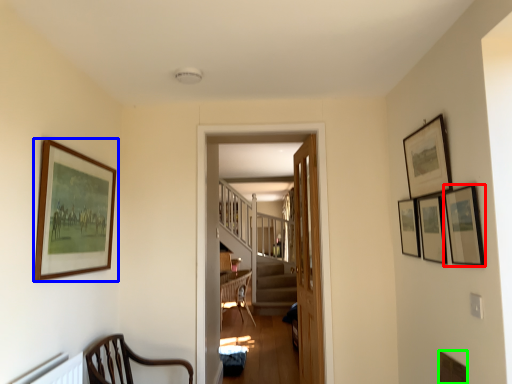
Question: Estimate the real-world distances between objects in this image. Which object is closer to picture frame (highlighted by a red box), picture frame (highlighted by a blue box) or picture frame (highlighted by a green box)?

Choices:
 (A) picture frame
 (B) picture frame

Answer: (B)